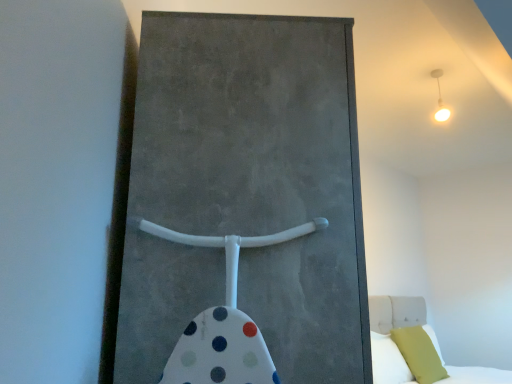
Question: Are matte yellow pillow at lower right, which is the 1th pillow from right to left, and white glossy light fixture at upper right beside each other?

Choices:
 (A) no
 (B) yes

Answer: (A)

Question: Could you tell me if matte yellow pillow at lower right, which is the 1th pillow from right to left, is turned towards white glossy light fixture at upper right?

Choices:
 (A) no
 (B) yes

Answer: (A)

Question: Is matte yellow pillow at lower right, which ranks as the second pillow in left-to-right order, not near white glossy light fixture at upper right?

Choices:
 (A) yes
 (B) no

Answer: (A)

Question: Does matte yellow pillow at lower right, which ranks as the second pillow in left-to-right order, lie behind white glossy light fixture at upper right?

Choices:
 (A) yes
 (B) no

Answer: (A)

Question: Does matte yellow pillow at lower right, which ranks as the second pillow in left-to-right order, have a lesser height compared to white glossy light fixture at upper right?

Choices:
 (A) yes
 (B) no

Answer: (B)

Question: Is matte yellow pillow at lower right, which is the 1th pillow from right to left, to the right of white glossy light fixture at upper right from the viewer's perspective?

Choices:
 (A) yes
 (B) no

Answer: (A)

Question: Considering the relative sizes of white fabric bed at lower right and matte yellow pillow at lower right, which is the 1th pillow from right to left, in the image provided, is white fabric bed at lower right bigger than matte yellow pillow at lower right, which is the 1th pillow from right to left,?

Choices:
 (A) yes
 (B) no

Answer: (A)

Question: Is white fabric bed at lower right thinner than matte yellow pillow at lower right, which is the 1th pillow from right to left?

Choices:
 (A) yes
 (B) no

Answer: (B)

Question: Considering the relative positions of white fabric bed at lower right and matte yellow pillow at lower right, which is the 1th pillow from right to left, in the image provided, is white fabric bed at lower right behind matte yellow pillow at lower right, which is the 1th pillow from right to left,?

Choices:
 (A) no
 (B) yes

Answer: (A)

Question: From a real-world perspective, is white fabric bed at lower right on top of matte yellow pillow at lower right, which ranks as the second pillow in left-to-right order?

Choices:
 (A) yes
 (B) no

Answer: (A)

Question: Could you tell me if white fabric bed at lower right is turned towards matte yellow pillow at lower right, which is the 1th pillow from right to left?

Choices:
 (A) yes
 (B) no

Answer: (A)

Question: Is white fabric bed at lower right turned away from matte yellow pillow at lower right, which is the 1th pillow from right to left?

Choices:
 (A) no
 (B) yes

Answer: (B)

Question: From the image's perspective, is concrete textured barn door at center over matte yellow pillow at lower right, which is the 1th pillow from right to left?

Choices:
 (A) yes
 (B) no

Answer: (A)